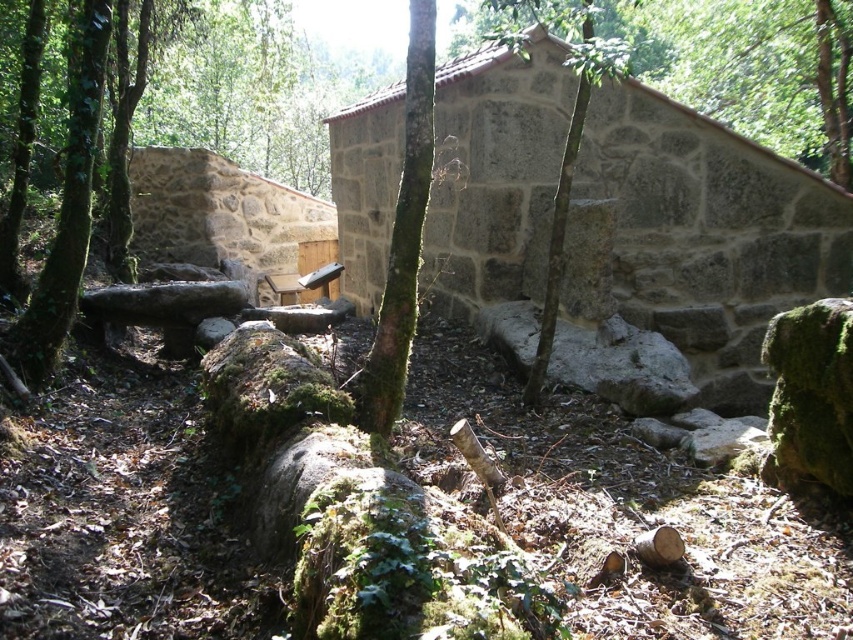
You are a hiker who wants to take a break. You see the green mossy tree at center and the green mossy tree trunk at center. Which one would you sit on if you want to rest?

The green mossy tree at center is bigger than the green mossy tree trunk at center, so you should sit on the green mossy tree at center for more comfort.